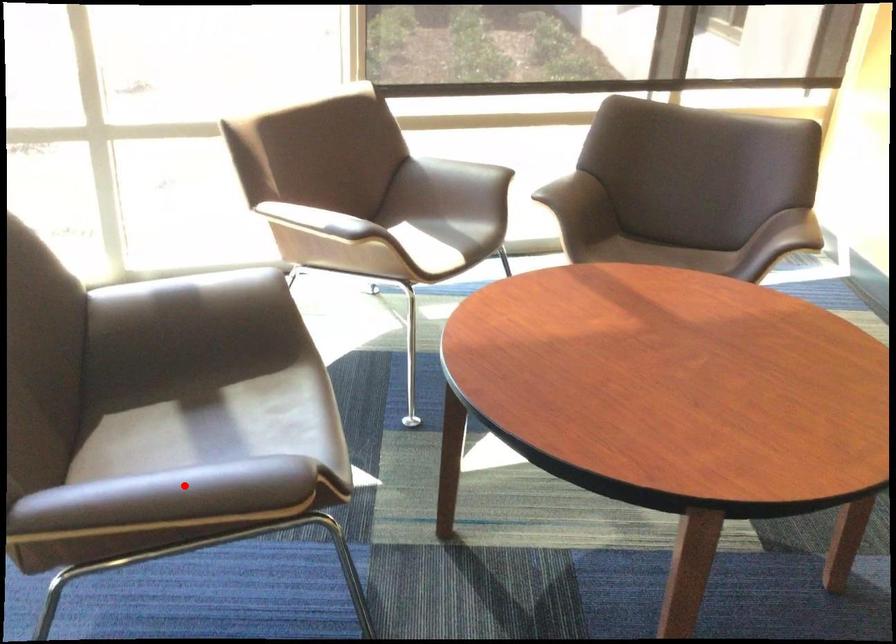
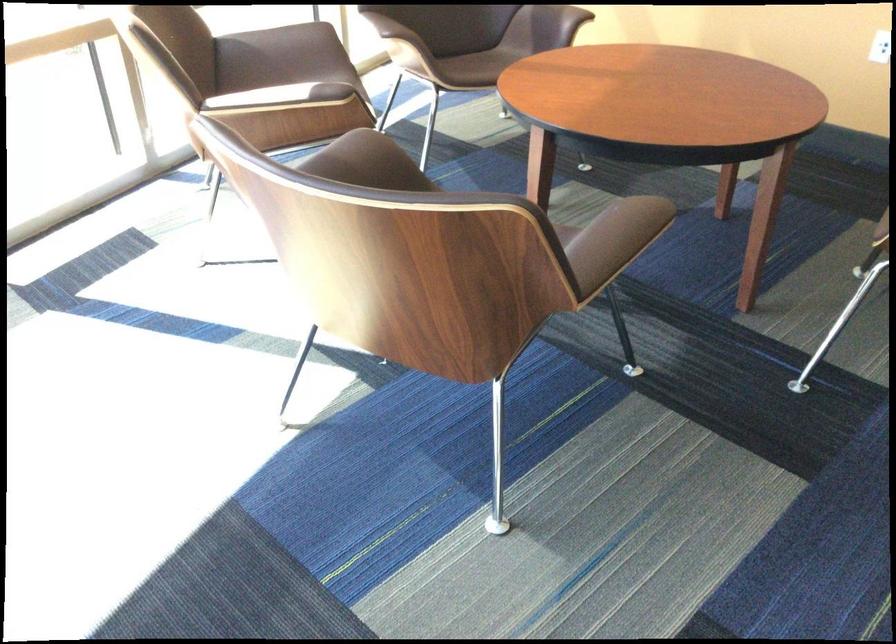
In the second image, find the point that corresponds to the highlighted location in the first image.

(614, 240)